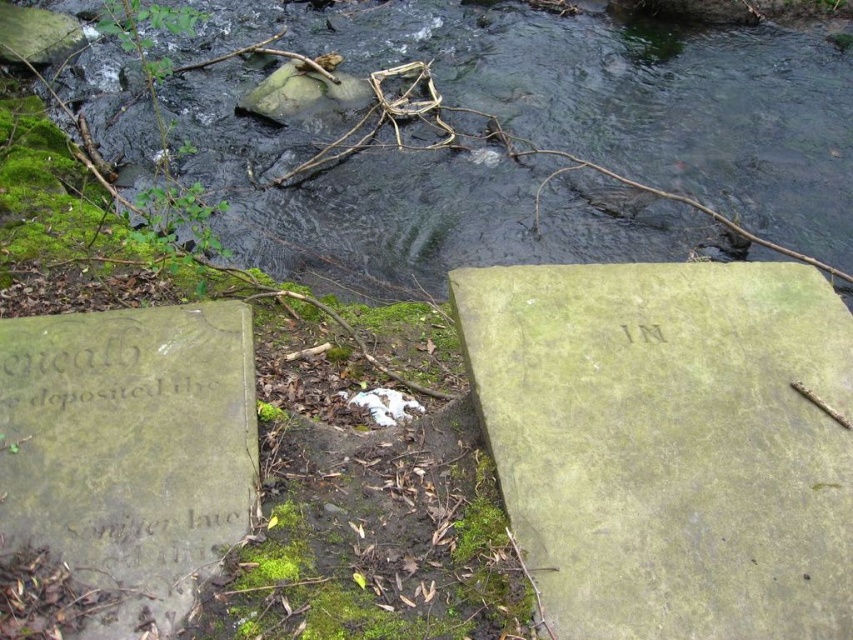
Question: Is green mossy rock at upper center smaller than green stone plaque at center?

Choices:
 (A) yes
 (B) no

Answer: (A)

Question: Can you confirm if green stone plaque at center is wider than green mossy stone at lower left?

Choices:
 (A) no
 (B) yes

Answer: (B)

Question: Among these objects, which one is farthest from the camera?

Choices:
 (A) green stone plaque at center
 (B) green mossy stone at lower left
 (C) green mossy rock at upper center

Answer: (C)

Question: Which point appears farthest from the camera in this image?

Choices:
 (A) (225, 90)
 (B) (248, 371)
 (C) (828, 596)

Answer: (A)

Question: Among these objects, which one is farthest from the camera?

Choices:
 (A) green mossy rock at upper center
 (B) green mossy stone at lower left
 (C) green stone plaque at center

Answer: (A)

Question: Does green mossy rock at upper center appear over green mossy stone at lower left?

Choices:
 (A) no
 (B) yes

Answer: (B)